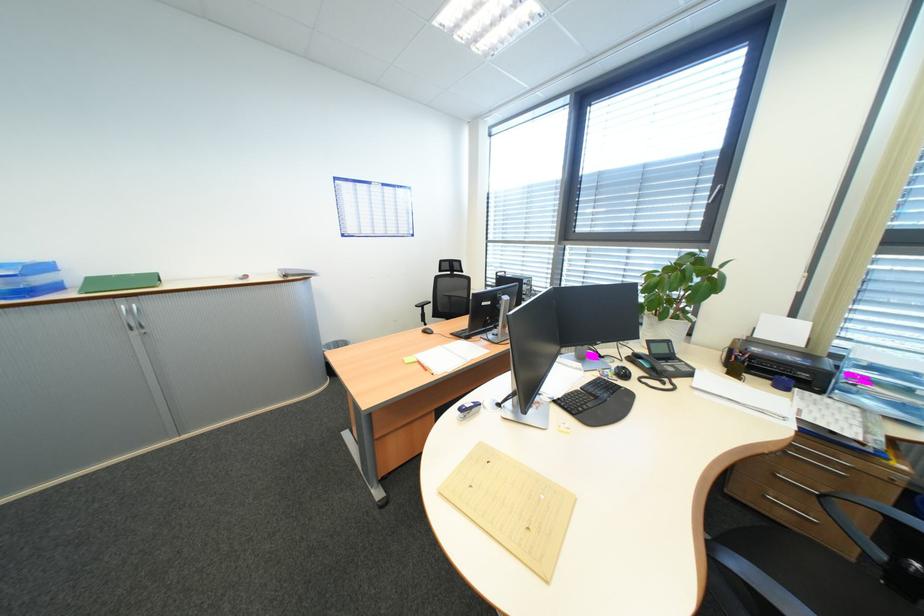
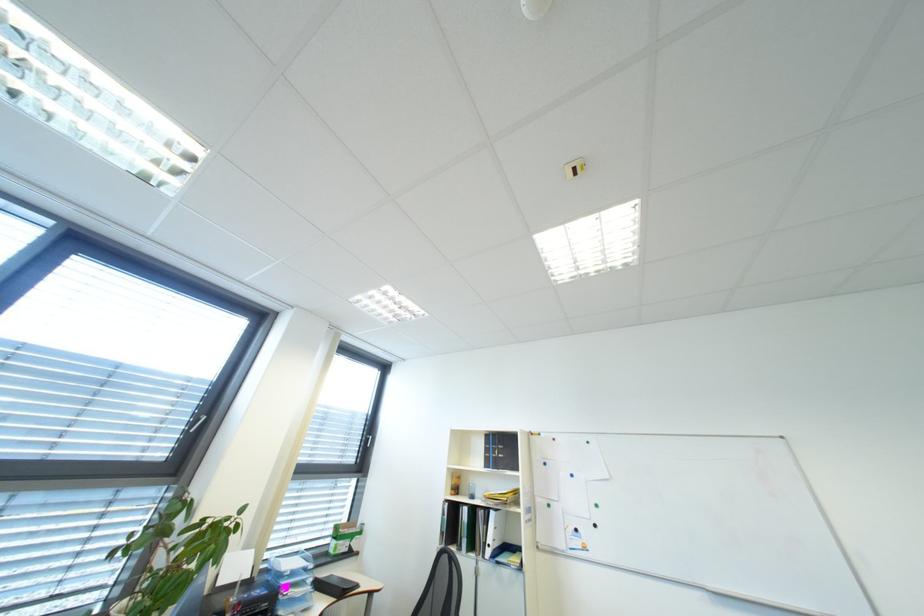
The point at (865, 387) is marked in the first image. Where is the corresponding point in the second image?

(298, 596)